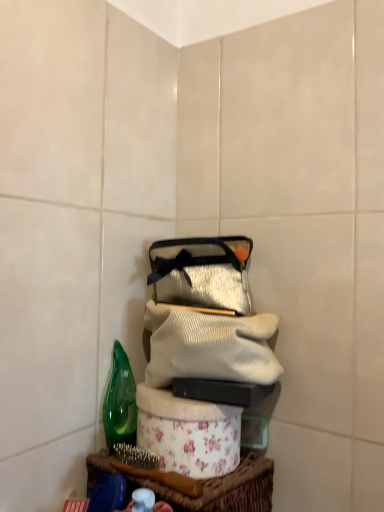
Describe the element at coordinates (120, 402) in the screenshot. I see `green glass bottle at left` at that location.

Locate an element on the screen. This screenshot has width=384, height=512. floral fabric basket at lower center is located at coordinates (220, 489).

Describe the element at coordinates (208, 346) in the screenshot. I see `white ribbed sweater at center` at that location.

Where is `green glass bottle at left`? The width and height of the screenshot is (384, 512). green glass bottle at left is located at coordinates (120, 402).

Which is closer, (170, 249) or (156, 488)?

Positioned in front is point (156, 488).

What's the angular difference between shiny silver pouch at center and floral fabric basket at lower center's facing directions?

0.00201 degrees.

Considering the sizes of objects shiny silver pouch at center and floral fabric basket at lower center in the image provided, who is wider, shiny silver pouch at center or floral fabric basket at lower center?

With larger width is shiny silver pouch at center.

Can you confirm if shiny silver pouch at center is smaller than floral fabric basket at lower center?

Yes, shiny silver pouch at center is smaller than floral fabric basket at lower center.

Which is nearer, (236, 469) or (240, 285)?

The point (236, 469) is more forward.

Could shiny silver pouch at center be considered to be inside floral fabric basket at lower center?

Actually, shiny silver pouch at center is outside floral fabric basket at lower center.

Which object is closer to the camera taking this photo, floral fabric basket at lower center or shiny silver pouch at center?

floral fabric basket at lower center.

Is green glass bottle at left to the left or to the right of floral fabric basket at lower center in the image?

Based on their positions, green glass bottle at left is located to the left of floral fabric basket at lower center.

Is green glass bottle at left positioned far away from floral fabric basket at lower center?

No, green glass bottle at left is not far from floral fabric basket at lower center.

Between point (115, 397) and point (262, 500), which one is positioned behind?

The point (115, 397) is farther from the camera.

Considering the sizes of green glass bottle at left and floral fabric basket at lower center in the image, is green glass bottle at left taller or shorter than floral fabric basket at lower center?

In the image, green glass bottle at left appears to be shorter than floral fabric basket at lower center.

Is white ribbed sweater at center directly adjacent to green glass bottle at left?

white ribbed sweater at center is not next to green glass bottle at left, and they're not touching.

Is white ribbed sweater at center positioned in front of green glass bottle at left?

Yes, it is.

How far apart are white ribbed sweater at center and green glass bottle at left?

The distance of white ribbed sweater at center from green glass bottle at left is 15.23 centimeters.

In the image, there is a white ribbed sweater at center. Where is `bottle below it (from the image's perspective)`? bottle below it (from the image's perspective) is located at coordinates (120, 402).

Is floral fabric basket at lower center positioned behind green glass bottle at left?

No, the depth of floral fabric basket at lower center is less than that of green glass bottle at left.

Is floral fabric basket at lower center facing away from green glass bottle at left?

That's not correct — floral fabric basket at lower center is not looking away from green glass bottle at left.

Are floral fabric basket at lower center and green glass bottle at left far apart?

No, floral fabric basket at lower center is in close proximity to green glass bottle at left.

Considering the sizes of objects white ribbed sweater at center and floral fabric basket at lower center in the image provided, who is smaller, white ribbed sweater at center or floral fabric basket at lower center?

With smaller size is white ribbed sweater at center.

Is floral fabric basket at lower center at the back of white ribbed sweater at center?

That's not correct — white ribbed sweater at center is not looking away from floral fabric basket at lower center.

Does point (172, 352) come closer to viewer compared to point (271, 493)?

Yes.

Which is in front, green glass bottle at left or white ribbed sweater at center?

Positioned in front is white ribbed sweater at center.

In the scene shown: Is green glass bottle at left oriented towards white ribbed sweater at center?

Yes, green glass bottle at left faces towards white ribbed sweater at center.

Considering the sizes of objects green glass bottle at left and white ribbed sweater at center in the image provided, who is taller, green glass bottle at left or white ribbed sweater at center?

green glass bottle at left is taller.

You are a GUI agent. You are given a task and a screenshot of the screen. Output one action in this format:
    pyautogui.click(x=<x>, y=<y>)
    Task: Click on the table on the left of shiny silver pouch at center
    Image resolution: width=384 pixels, height=512 pixels.
    Given the screenshot: What is the action you would take?
    pyautogui.click(x=220, y=489)

In the image, there is a shiny silver pouch at center. Where is `table below it (from a real-world perspective)`? Image resolution: width=384 pixels, height=512 pixels. table below it (from a real-world perspective) is located at coordinates (220, 489).

Looking at the image, which one is located further to green glass bottle at left, floral fabric basket at lower center or white ribbed sweater at center?

white ribbed sweater at center is further to green glass bottle at left.

Estimate the real-world distances between objects in this image. Which object is closer to green glass bottle at left, white ribbed sweater at center or floral fabric basket at lower center?

floral fabric basket at lower center is closer to green glass bottle at left.

Based on their spatial positions, is green glass bottle at left or white ribbed sweater at center closer to floral fabric basket at lower center?

green glass bottle at left is positioned closer to the anchor floral fabric basket at lower center.

From the image, which object appears to be farther from green glass bottle at left, shiny silver pouch at center or white ribbed sweater at center?

Based on the image, shiny silver pouch at center appears to be further to green glass bottle at left.

Looking at the image, which one is located closer to white ribbed sweater at center, shiny silver pouch at center or floral fabric basket at lower center?

shiny silver pouch at center is positioned closer to the anchor white ribbed sweater at center.

When comparing their distances from white ribbed sweater at center, does floral fabric basket at lower center or shiny silver pouch at center seem further?

floral fabric basket at lower center is positioned further to the anchor white ribbed sweater at center.

Estimate the real-world distances between objects in this image. Which object is further from floral fabric basket at lower center, shiny silver pouch at center or white ribbed sweater at center?

shiny silver pouch at center.

Estimate the real-world distances between objects in this image. Which object is closer to shiny silver pouch at center, green glass bottle at left or white ribbed sweater at center?

The object closer to shiny silver pouch at center is white ribbed sweater at center.

Where is `clothing between shiny silver pouch at center and green glass bottle at left in the vertical direction`? The height and width of the screenshot is (512, 384). clothing between shiny silver pouch at center and green glass bottle at left in the vertical direction is located at coordinates 208,346.

I want to click on bottle that lies between shiny silver pouch at center and floral fabric basket at lower center from top to bottom, so click(x=120, y=402).

Locate an element on the screen. clothing between shiny silver pouch at center and floral fabric basket at lower center in the vertical direction is located at coordinates (208, 346).

Find the location of a particular element. This screenshot has height=512, width=384. bottle between white ribbed sweater at center and floral fabric basket at lower center in the vertical direction is located at coordinates (120, 402).